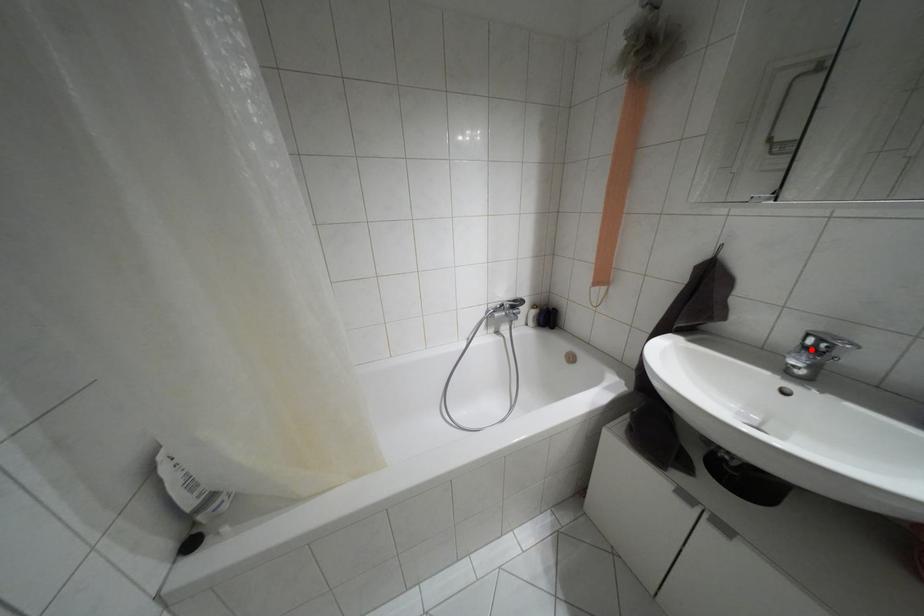
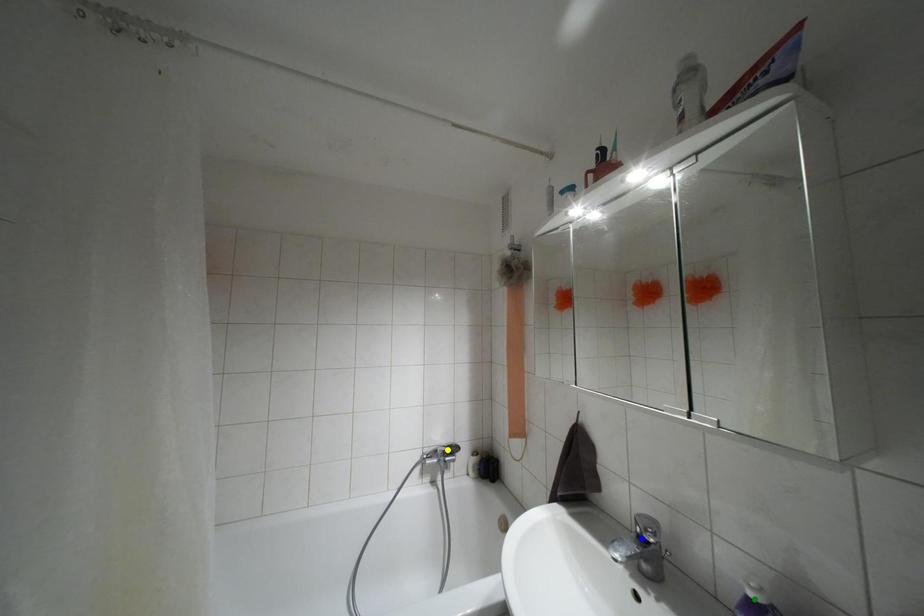
Question: I am providing you with two images of the same scene from different viewpoints. A red point is marked on the first image. You are given multiple points on the second image. Which point in image 2 represents the same 3d spot as the red point in image 1?

Choices:
 (A) yellow point
 (B) green point
 (C) blue point

Answer: (C)